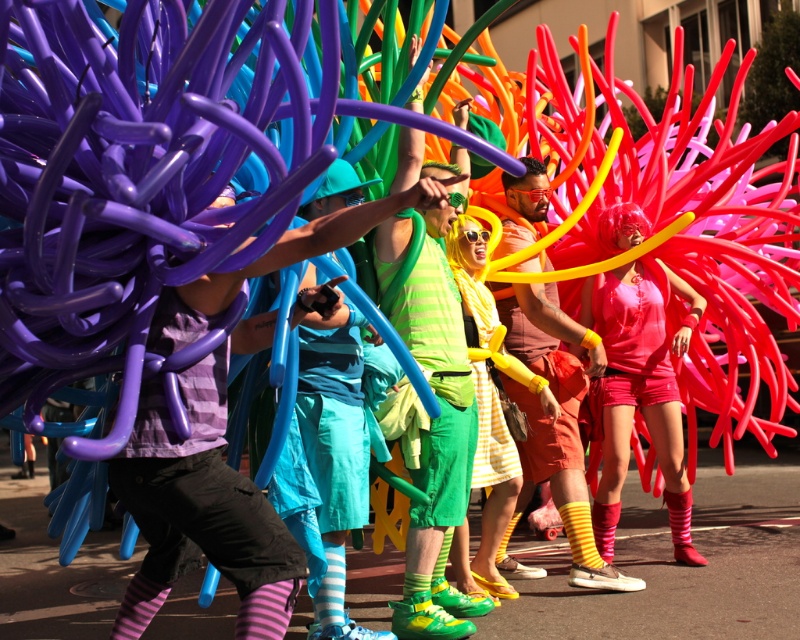
You are standing at the center of the street and looking towards the parade. Where is the matte purple balloon at center located in relation to your current position?

The matte purple balloon at center is located at point 0.803 on the x axis and 0.251 on the y axis relative to your current position at the center of the street.

You are a photographer standing in front of the parade participants. You notice the matte purple balloon at center and the matte pink tank top at center. Which object is positioned closer to you?

The matte purple balloon at center is closer to the viewer than the matte pink tank top at center.

You are a photographer trying to capture the perfect shot of the matte purple balloon at center and the matte pink tank top at center. If you want to ensure both are fully visible in your frame, which object should you focus on first to avoid cropping?

The matte purple balloon at center is shorter than the matte pink tank top at center, so you should focus on the matte pink tank top at center first to ensure it fits entirely within the frame.